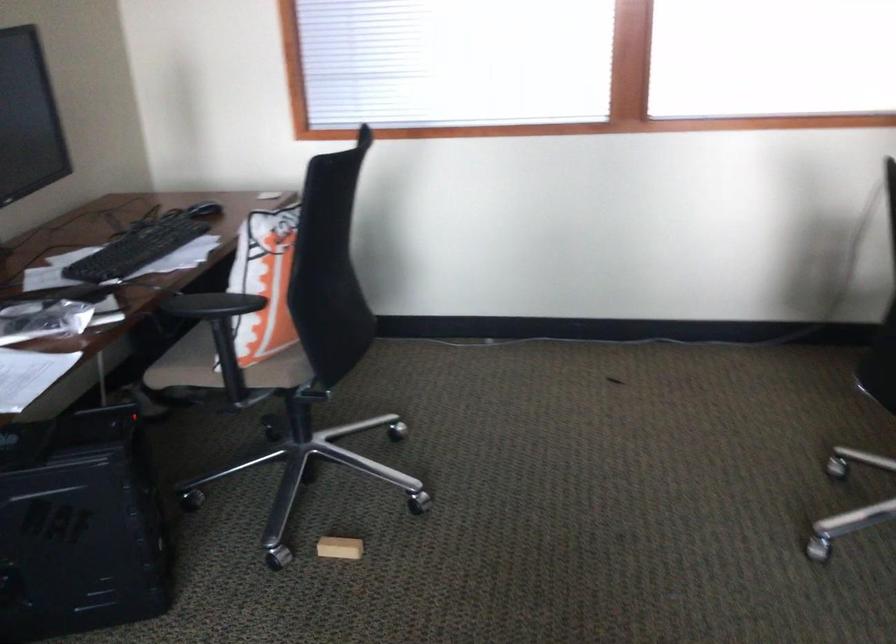
Image resolution: width=896 pixels, height=644 pixels. What do you see at coordinates (211, 305) in the screenshot?
I see `the black chair armrest` at bounding box center [211, 305].